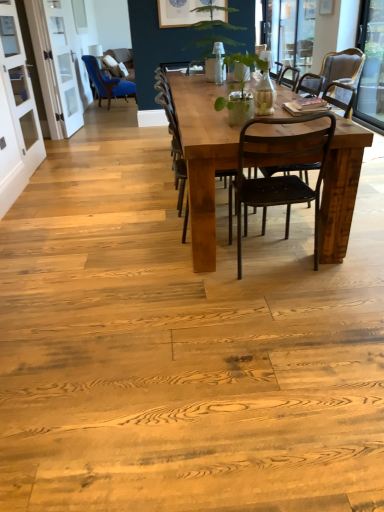
Question: Is white glass screen door at left, positioned as the first screen door in front-to-back order, not close to rustic wood table at center?

Choices:
 (A) yes
 (B) no

Answer: (A)

Question: Is white glass screen door at left, which ranks as the second screen door in back-to-front order, at the right side of rustic wood table at center?

Choices:
 (A) no
 (B) yes

Answer: (A)

Question: Could you tell me if white glass screen door at left, positioned as the first screen door in front-to-back order, is facing rustic wood table at center?

Choices:
 (A) yes
 (B) no

Answer: (A)

Question: Does white glass screen door at left, positioned as the first screen door in front-to-back order, have a greater height compared to rustic wood table at center?

Choices:
 (A) yes
 (B) no

Answer: (A)

Question: Is rustic wood table at center located within white glass screen door at left, which ranks as the second screen door in back-to-front order?

Choices:
 (A) no
 (B) yes

Answer: (A)

Question: Is white glass screen door at left, positioned as the first screen door in front-to-back order, to the left of rustic wood table at center from the viewer's perspective?

Choices:
 (A) yes
 (B) no

Answer: (A)

Question: Considering the relative sizes of rustic wood chair at center, placed as the second chair when sorted from left to right, and white glass screen door at left, which ranks as the second screen door in back-to-front order, in the image provided, is rustic wood chair at center, placed as the second chair when sorted from left to right, bigger than white glass screen door at left, which ranks as the second screen door in back-to-front order,?

Choices:
 (A) no
 (B) yes

Answer: (B)

Question: Is rustic wood chair at center, the fourth chair when ordered from back to front, smaller than white glass screen door at left, which ranks as the second screen door in back-to-front order?

Choices:
 (A) no
 (B) yes

Answer: (A)

Question: Is rustic wood chair at center, which is the second chair in front-to-back order, at the left side of white glass screen door at left, positioned as the first screen door in front-to-back order?

Choices:
 (A) yes
 (B) no

Answer: (B)

Question: Is rustic wood chair at center, the fourth chair when ordered from back to front, positioned beyond the bounds of white glass screen door at left, positioned as the first screen door in front-to-back order?

Choices:
 (A) no
 (B) yes

Answer: (B)

Question: From a real-world perspective, is rustic wood chair at center, the fourth chair viewed from the right, on top of white glass screen door at left, which ranks as the second screen door in back-to-front order?

Choices:
 (A) no
 (B) yes

Answer: (A)

Question: Considering the relative positions of rustic wood chair at center, which is the second chair in front-to-back order, and white glass screen door at left, which ranks as the second screen door in back-to-front order, in the image provided, is rustic wood chair at center, which is the second chair in front-to-back order, to the right of white glass screen door at left, which ranks as the second screen door in back-to-front order, from the viewer's perspective?

Choices:
 (A) yes
 (B) no

Answer: (A)

Question: From the image's perspective, is white glass screen door at upper left, arranged as the 2th screen door when viewed from the front, beneath transparent glass window at upper right, which appears as the 2th window screen when ordered from the bottom?

Choices:
 (A) no
 (B) yes

Answer: (B)